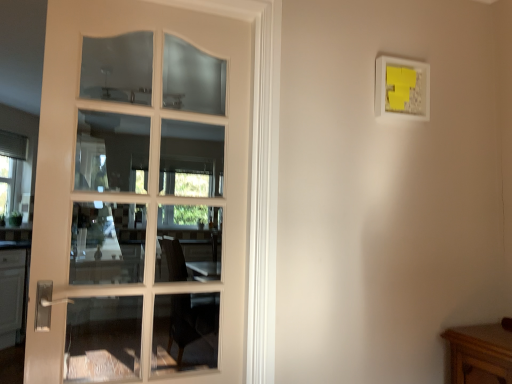
Question: Relative to white matte picture frame at upper right, is wooden table at lower right in front or behind?

Choices:
 (A) behind
 (B) front

Answer: (B)

Question: From the image's perspective, relative to white matte picture frame at upper right, is wooden table at lower right above or below?

Choices:
 (A) below
 (B) above

Answer: (A)

Question: Considering the real-world distances, which object is farthest from the wooden table at lower right?

Choices:
 (A) white matte picture frame at upper right
 (B) white glossy door at left

Answer: (B)

Question: Which is nearer to the white glossy door at left?

Choices:
 (A) wooden table at lower right
 (B) white matte picture frame at upper right

Answer: (B)